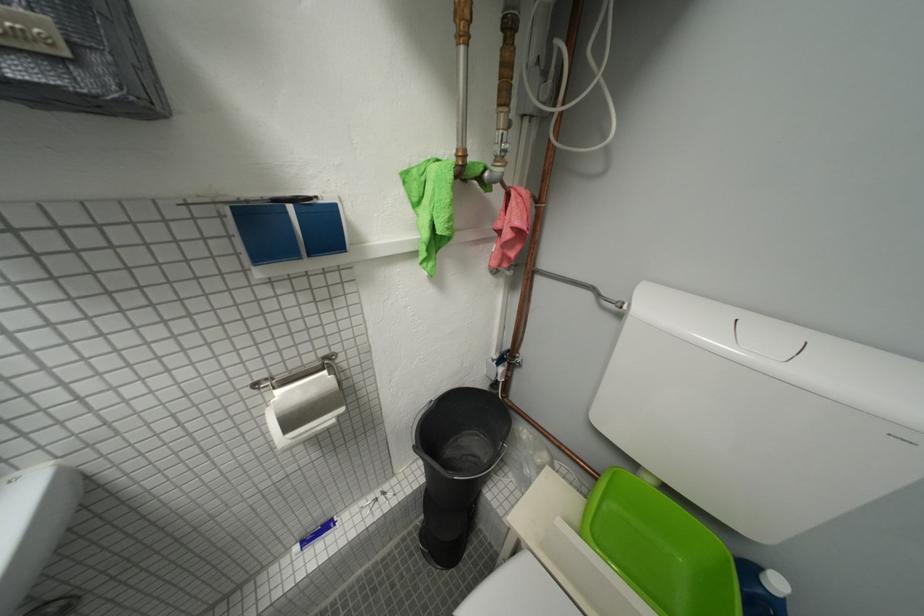
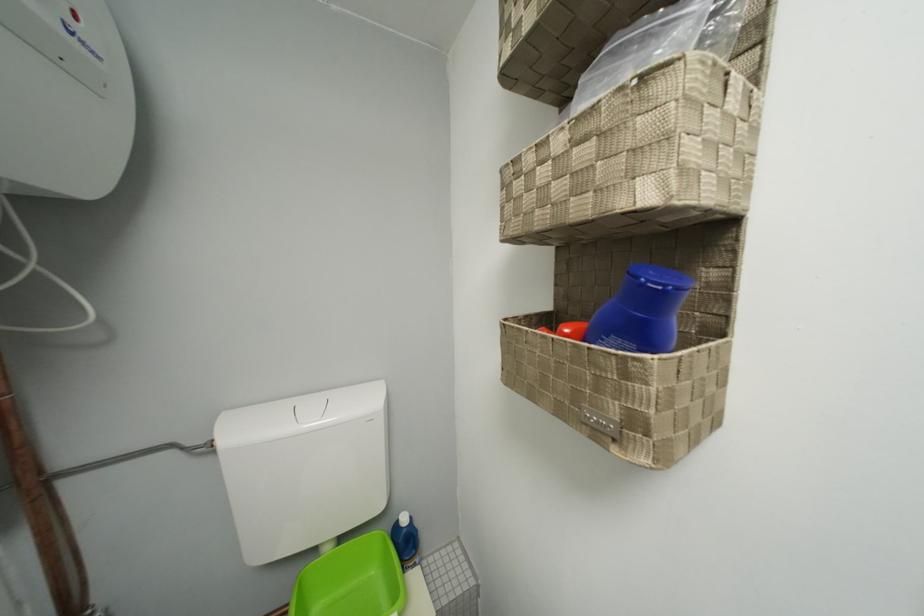
Question: The camera is either moving clockwise (left) or counter-clockwise (right) around the object. The first image is from the beginning of the video and the second image is from the end. Is the camera moving left or right when shooting the video?

Choices:
 (A) Left
 (B) Right

Answer: (A)